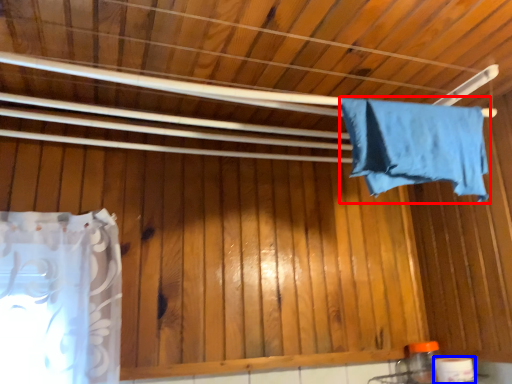
Question: Which point is further to the camera, towel (highlighted by a red box) or toilet paper (highlighted by a blue box)?

Choices:
 (A) towel
 (B) toilet paper

Answer: (B)